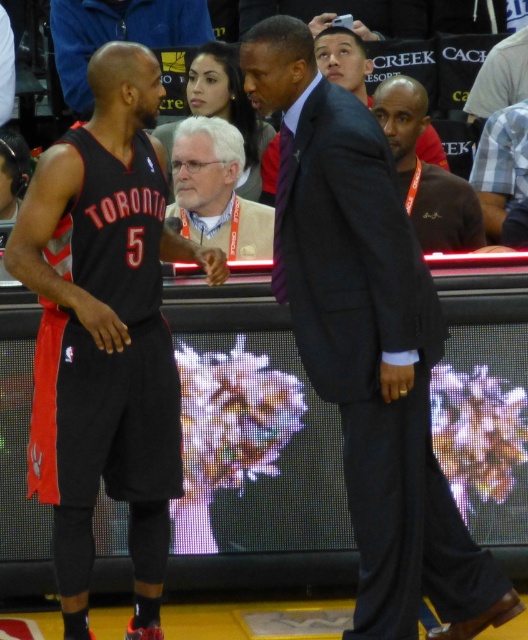
You are a photographer standing at the edge of the court during a basketball game. You want to take a photo of both the player in the black Toronto Raptors jersey with the number 5 and the coach in formal attire. The player is at point (260, 51) and the coach is at point (68, 8). Which of these two individuals will appear larger in your photo?

Point (260, 51) is closer to the camera than point (68, 8), so the player in the black Toronto Raptors jersey with the number 5 at point (260, 51) will appear larger in the photo.

Looking at this image, in the basketball game scene, you notice two black jerseys. One is the matte black jersey at left and the other is the black jersey at center. Which of these two black jerseys is taller?

The matte black jersey at left is taller than the black jersey at center.